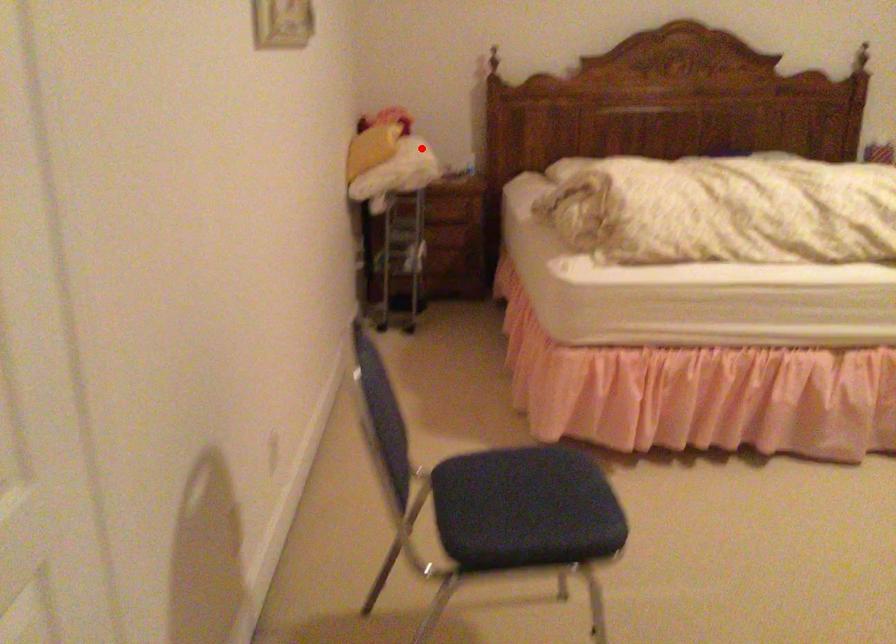
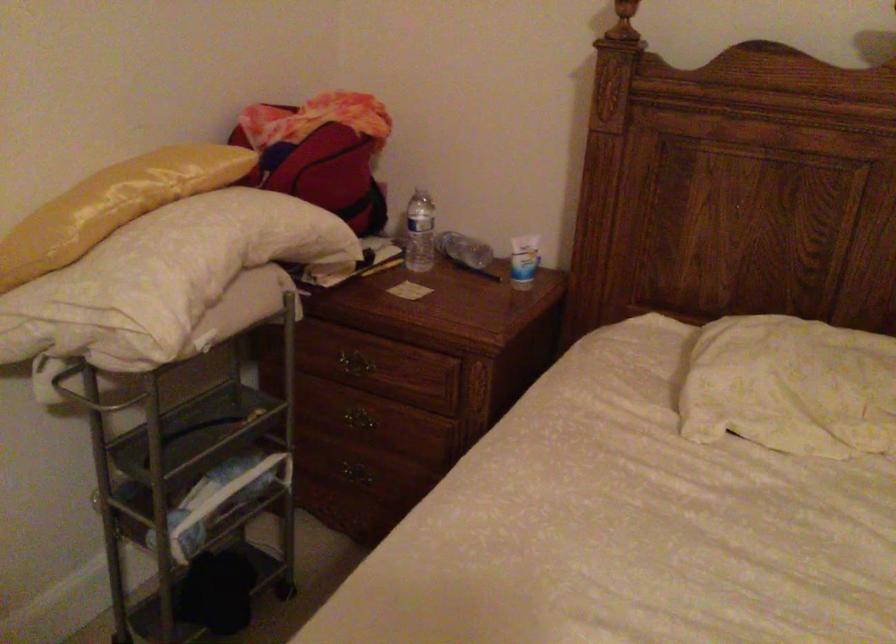
Locate, in the second image, the point that corresponds to the highlighted location in the first image.

(164, 278)